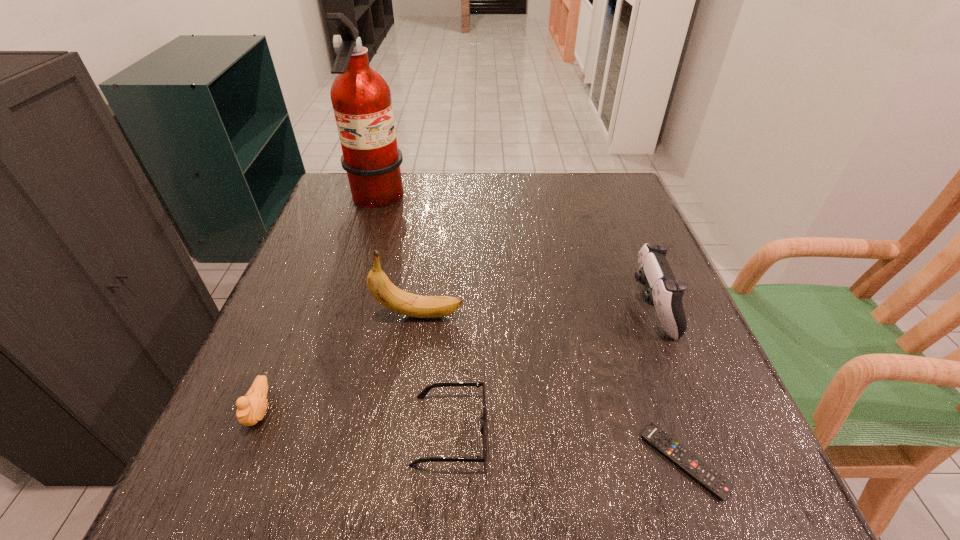
Find the location of a particular element. The height and width of the screenshot is (540, 960). vacant space that satisfies the following two spatial constraints: 1. at the start of the peel on the remote control; 2. on the left side of the banana is located at coordinates (398, 461).

Image resolution: width=960 pixels, height=540 pixels. I want to click on vacant space that satisfies the following two spatial constraints: 1. at the start of the peel on the banana; 2. on the face of the duckling, so click(x=406, y=409).

Identify the location of vacant space that satisfies the following two spatial constraints: 1. at the start of the peel on the remote control; 2. on the left side of the banana. This screenshot has height=540, width=960. (398, 461).

Where is `blank space that satisfies the following two spatial constraints: 1. on the front-facing side of the control; 2. on the front side of the shortest object`? The width and height of the screenshot is (960, 540). blank space that satisfies the following two spatial constraints: 1. on the front-facing side of the control; 2. on the front side of the shortest object is located at coordinates (713, 461).